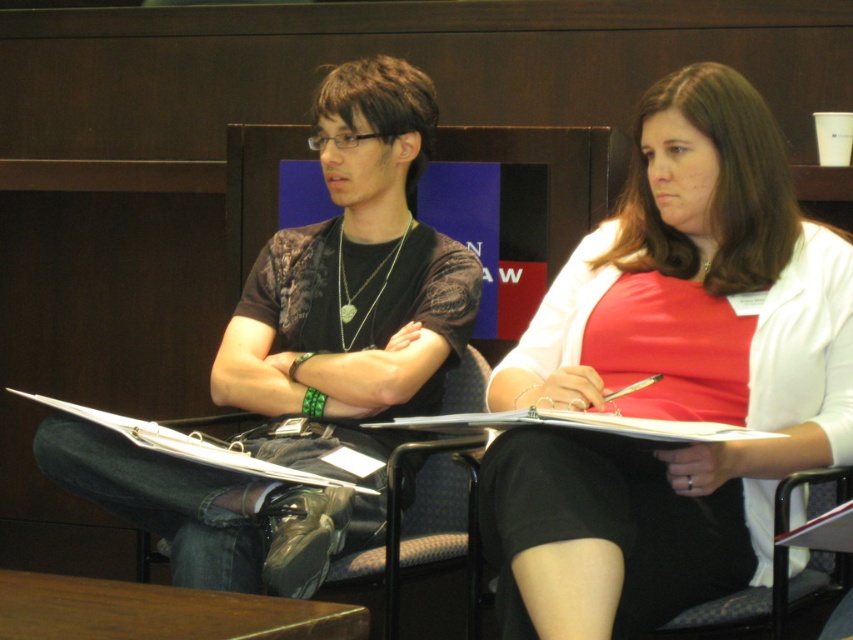
You are standing in front of the two people in the image. There is a point at coordinates (247, 353) that is 2.21 meters away from you. If you want to place a small gift exactly at that point, will you be able to reach it without moving your feet?

The point at coordinates (247, 353) is 2.21 meters away from you. Since the average person can reach about 2 meters, you will not be able to reach it without moving your feet.

Based on the photo, you are standing in the conference room and want to move from the point at the bottom right corner to the point near the center. The points are labeled as point (404, 380) and point (19, 625). Which point should you move towards if you want to go to the one that is behind the other?

You should move towards point (404, 380) because it is behind point (19, 625) according to the spatial relationship provided.